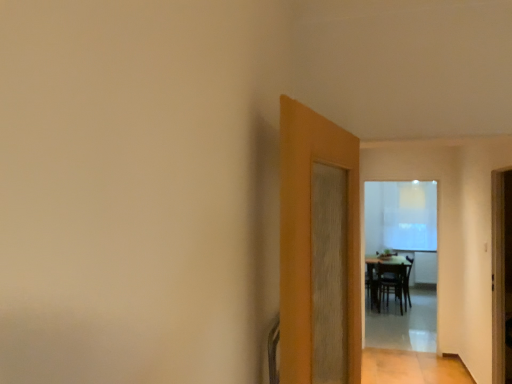
In order to face dark brown wooden chair at center, should I rotate leftwards or rightwards?

You should rotate right by 18.594 degrees.

Image resolution: width=512 pixels, height=384 pixels. In order to click on dark brown wooden chair at center in this screenshot , I will do `click(391, 283)`.

The image size is (512, 384). What do you see at coordinates (391, 283) in the screenshot?
I see `dark brown wooden chair at center` at bounding box center [391, 283].

The width and height of the screenshot is (512, 384). I want to click on dark brown wooden chair at center, so click(391, 283).